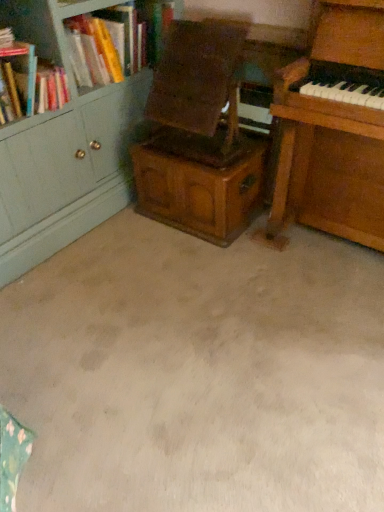
Locate an element on the screen. free space that is to the left of wooden cabinet at center is located at coordinates (118, 238).